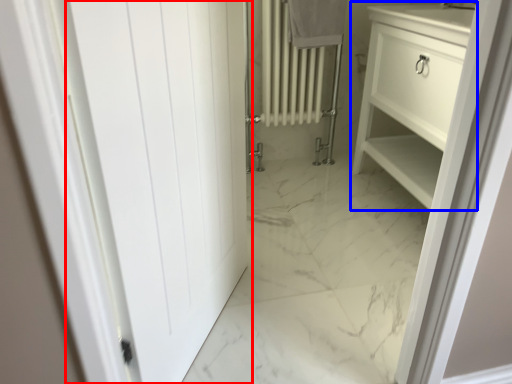
Question: Among these objects, which one is nearest to the camera, door (highlighted by a red box) or bathroom cabinet (highlighted by a blue box)?

Choices:
 (A) door
 (B) bathroom cabinet

Answer: (A)